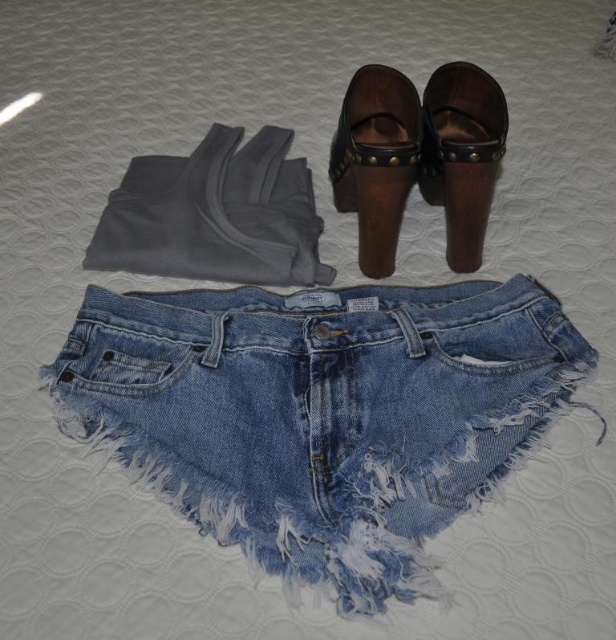
You are organizing a closet and need to place the gray fleece pants at upper left and the brown leather clog at upper center. According to their positions in the image, which item is closer to the left edge of the closet shelf?

The gray fleece pants at upper left are closer to the left edge of the closet shelf because they are positioned to the left of the brown leather clog at upper center.

You are trying to fold the sleeveless top and place it between the two points marked as point (275, 371) and point (164, 264). Which point should you place the folded top closer to to ensure it is in the front part of the outfit layout?

You should place the folded sleeveless top closer to point (275, 371) because it is closer to the viewer than point (164, 264), making it the front part of the outfit layout.

You are trying to pack your bag for a day trip and need to know if the faded denim shorts at center and the brown leather sandal at upper center can fit side by side in a compartment that is 12 inches wide. Can they fit?

The faded denim shorts at center and the brown leather sandal at upper center are 12.13 inches apart. Since the compartment is only 12 inches wide, they cannot fit side by side as the total width required exceeds the available space.